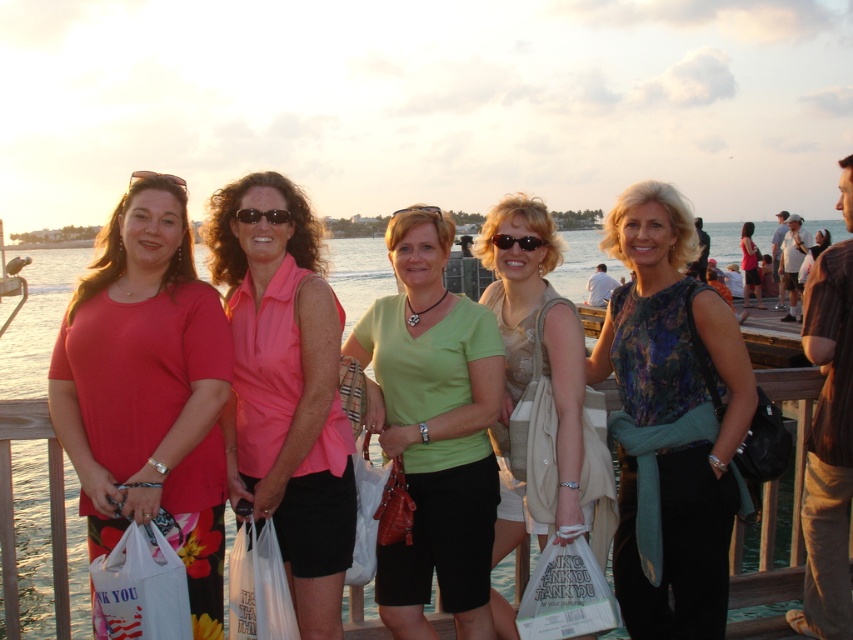
Please use the coordinates provided to determine the location of the green matte shirt at center relative to the other women. Is it closer to the front or the back of the group?

The coordinates of the green matte shirt at center are at point 0.672 on the x axis and 0.509 on the y axis. Since the x coordinate is closer to 1, it is positioned towards the right side of the group. However, the question asks about front or back. The y coordinate of 0.509 places it centrally in terms of depth, so it is neither closer to the front nor the back of the group.

You are a photographer trying to capture a group shot of the women on the pier. You notice the matte pink blouse at center and the clear plastic goggles at center. Which object should you focus on first if you want to ensure both are in the frame without cropping either?

The matte pink blouse at center is wider than the clear plastic goggles at center, so you should focus on the matte pink blouse at center first to ensure it fits within the frame.

You are standing on the wooden pier and want to walk towards the distant shoreline. Which point, point (747, 230) or point (434, 211), is closer to the shoreline?

Point (747, 230) is behind point (434, 211), so it is closer to the shoreline. Therefore, point (747, 230) is closer to the shoreline.